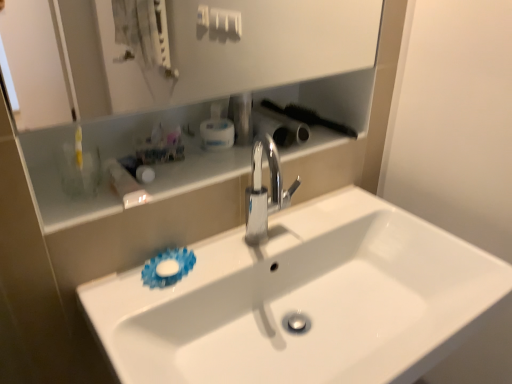
Question: Considering the relative positions of black plastic brush at upper right, which is the 2th brush from right to left, and black plastic brush at upper right, which is the 1th brush in right-to-left order, in the image provided, is black plastic brush at upper right, which is the 2th brush from right to left, to the left or to the right of black plastic brush at upper right, which is the 1th brush in right-to-left order,?

Choices:
 (A) right
 (B) left

Answer: (B)

Question: In the image, is black plastic brush at upper right, placed as the first brush when sorted from left to right, positioned in front of or behind black plastic brush at upper right, which is the 1th brush in right-to-left order?

Choices:
 (A) front
 (B) behind

Answer: (A)

Question: Based on their relative distances, which object is nearer to the black plastic brush at upper right, which is the 1th brush in right-to-left order?

Choices:
 (A) polished chrome faucet at center
 (B) metallic silver toothbrush at upper center, which ranks as the 2th toiletry in bottom-to-top order
 (C) white glossy sink at center
 (D) white glossy shelf at upper center
 (E) white plastic mouthwash at upper center

Answer: (B)

Question: Which object is positioned farthest from the white plastic mouthwash at upper center?

Choices:
 (A) black plastic brush at upper right, placed as the first brush when sorted from left to right
 (B) white glossy sink at center
 (C) polished chrome faucet at center
 (D) translucent plastic container at upper left, which is the second toiletry from top to bottom
 (E) black plastic brush at upper right, the second brush positioned from the left

Answer: (B)